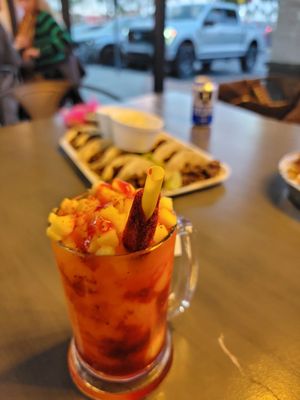
Identify the location of handle. This screenshot has height=400, width=300. (193, 245).